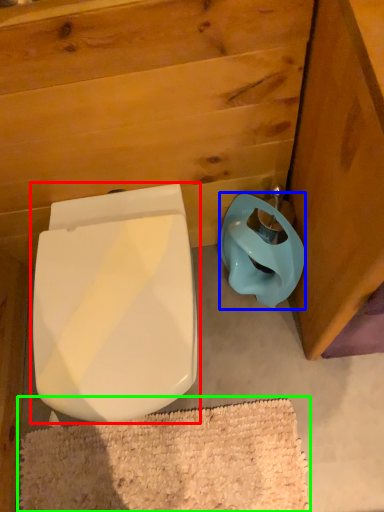
Question: Which object is the closest to the toilet (highlighted by a red box)? Choose among these: toilet bowl (highlighted by a blue box) or bath mat (highlighted by a green box).

Choices:
 (A) toilet bowl
 (B) bath mat

Answer: (A)